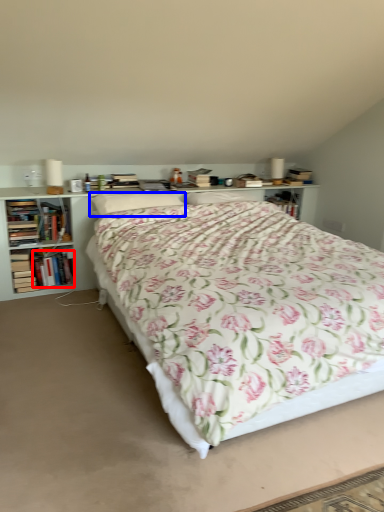
Question: Which of the following is the farthest to the observer, book (highlighted by a red box) or pillow (highlighted by a blue box)?

Choices:
 (A) book
 (B) pillow

Answer: (A)